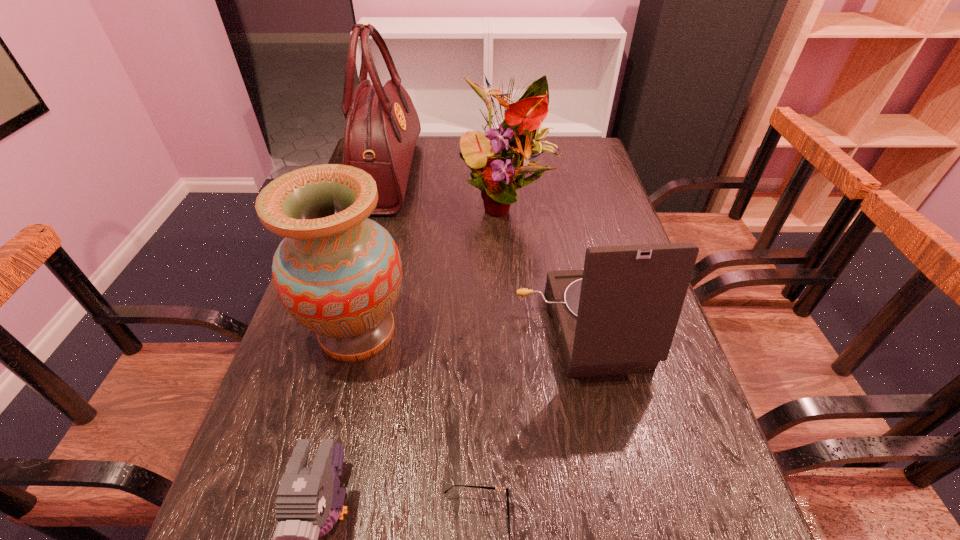
I want to click on vacant space that satisfies the following two spatial constraints: 1. on the front-facing side of the handbag; 2. on the right side of the phonograph record, so click(x=344, y=330).

Locate an element on the screen. blank area in the image that satisfies the following two spatial constraints: 1. on the back side of the phonograph record; 2. on the front-facing side of the handbag is located at coordinates (547, 174).

This screenshot has height=540, width=960. In order to click on free space that satisfies the following two spatial constraints: 1. on the front-facing side of the vase; 2. on the right side of the handbag in this screenshot , I will do `click(344, 332)`.

What are the coordinates of `vacant area that satisfies the following two spatial constraints: 1. on the front-facing side of the phonograph record; 2. on the left side of the tallest object` in the screenshot? It's located at (344, 330).